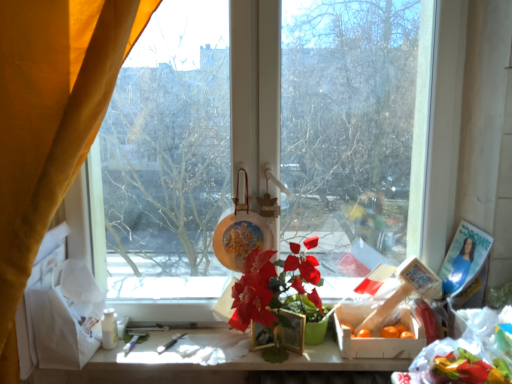
Question: Does velvet yellow curtain at left come behind transparent glass window at center?

Choices:
 (A) no
 (B) yes

Answer: (A)

Question: Is the position of velvet yellow curtain at left less distant than that of transparent glass window at center?

Choices:
 (A) no
 (B) yes

Answer: (B)

Question: Is velvet yellow curtain at left to the left of transparent glass window at center from the viewer's perspective?

Choices:
 (A) yes
 (B) no

Answer: (A)

Question: Is velvet yellow curtain at left located outside transparent glass window at center?

Choices:
 (A) yes
 (B) no

Answer: (A)

Question: From the image's perspective, is velvet yellow curtain at left on top of transparent glass window at center?

Choices:
 (A) yes
 (B) no

Answer: (B)

Question: Are velvet yellow curtain at left and transparent glass window at center far apart?

Choices:
 (A) yes
 (B) no

Answer: (B)

Question: Is transparent glass window at center not near matte plastic flower at center?

Choices:
 (A) yes
 (B) no

Answer: (B)

Question: Is the depth of transparent glass window at center less than that of matte plastic flower at center?

Choices:
 (A) yes
 (B) no

Answer: (B)

Question: Is transparent glass window at center wider than matte plastic flower at center?

Choices:
 (A) yes
 (B) no

Answer: (B)

Question: Is transparent glass window at center bigger than matte plastic flower at center?

Choices:
 (A) no
 (B) yes

Answer: (B)

Question: Does transparent glass window at center appear on the right side of matte plastic flower at center?

Choices:
 (A) no
 (B) yes

Answer: (A)

Question: Can you confirm if transparent glass window at center is thinner than matte plastic flower at center?

Choices:
 (A) yes
 (B) no

Answer: (A)

Question: Does transparent glass window at center have a greater width compared to velvet yellow curtain at left?

Choices:
 (A) no
 (B) yes

Answer: (A)